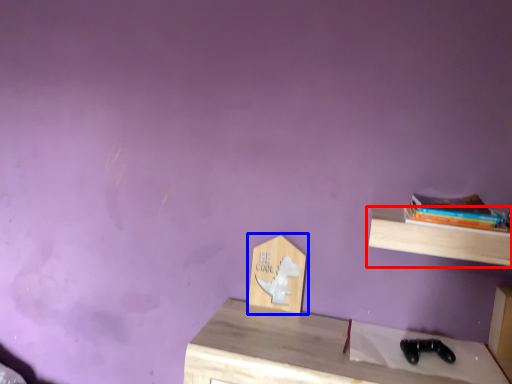
Question: Among these objects, which one is farthest to the camera, shelf (highlighted by a red box) or shelf (highlighted by a blue box)?

Choices:
 (A) shelf
 (B) shelf

Answer: (B)